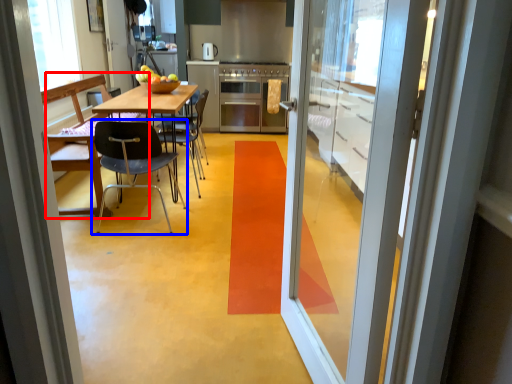
Question: Which of the following is the farthest to the observer, chair (highlighted by a red box) or chair (highlighted by a blue box)?

Choices:
 (A) chair
 (B) chair

Answer: (A)